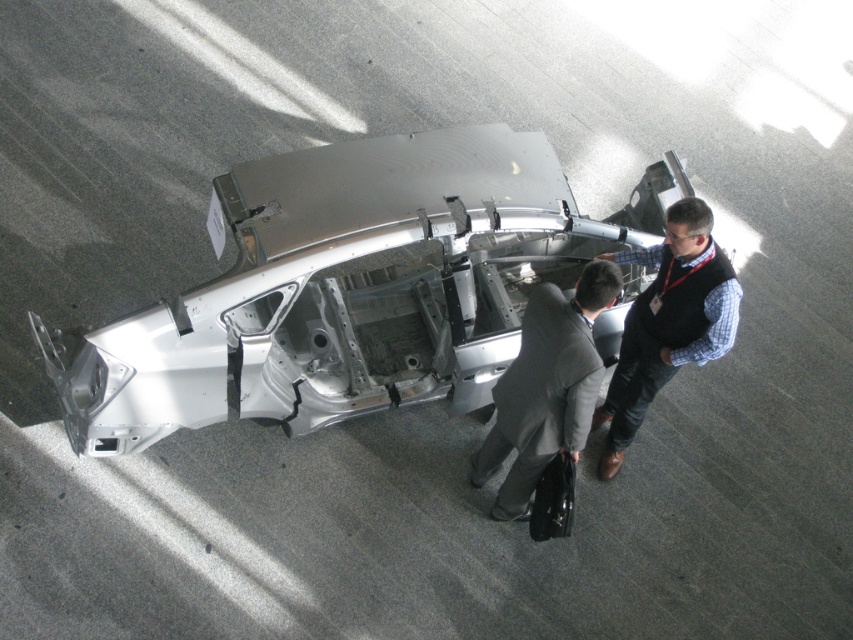
You are a photographer standing in the industrial setting. You need to take a photo of the silver metallic car at center without the dark gray suit at center appearing in the frame. Is this possible given their positions?

The silver metallic car at center is positioned over dark gray suit at center, so the car is directly above the suit. Since they are vertically aligned, adjusting the camera angle to capture the car without the suit might be challenging. However, by moving to the side or tilting the camera, it might be possible to frame the car while excluding the suit from the shot.

You are a tour guide at the exhibition and need to direct a visitor to the car chassis. The visitor asks, which person is standing to the left of the other? Mention both the dark gray suit at center and matte black vest at center in your answer.

The dark gray suit at center is positioned on the left side of matte black vest at center, so the person in the dark gray suit at center is to the left of the person in the matte black vest at center.

You are standing at the entrance of the industrial exhibition hall and see the silver metallic car at center. Where is the point with coordinates (347, 288) located?

The point with coordinates (347, 288) is located on the silver metallic car at center.